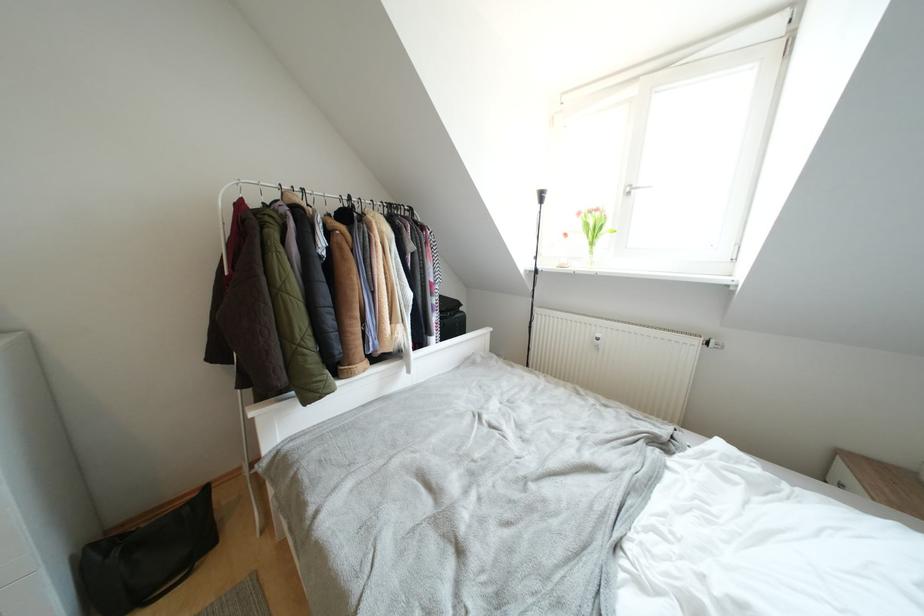
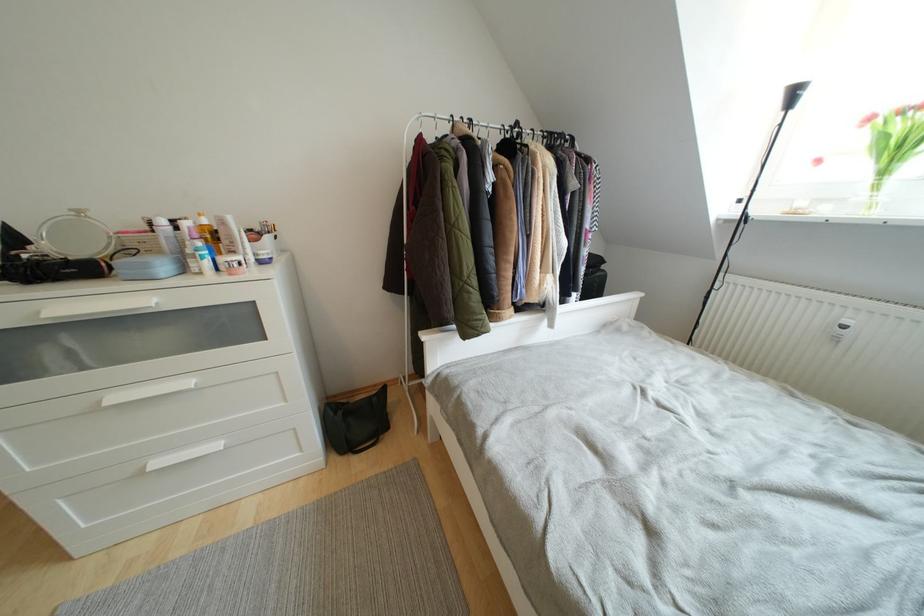
Question: Which direction would the cameraman need to move to produce the second image? Reply with the corresponding letter.

Choices:
 (A) Left
 (B) Right
 (C) Forward
 (D) Backward

Answer: (A)